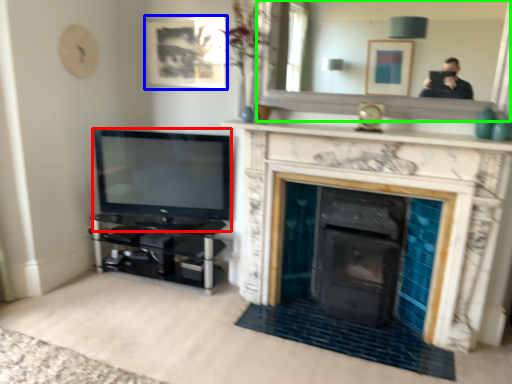
Question: Estimate the real-world distances between objects in this image. Which object is farther from television (highlighted by a red box), picture frame (highlighted by a blue box) or mirror (highlighted by a green box)?

Choices:
 (A) picture frame
 (B) mirror

Answer: (B)